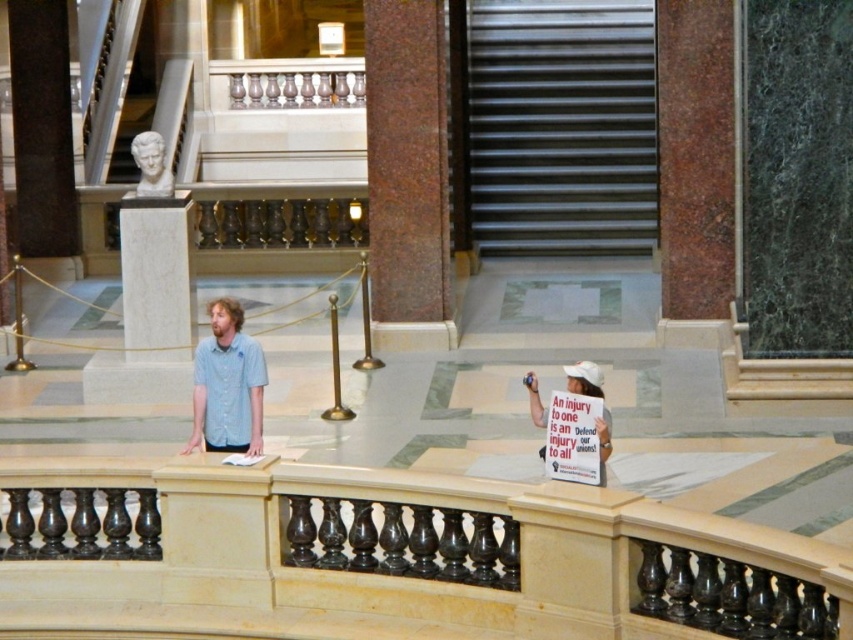
Between polished stone balustrade at center and metallic gray stairs at center, which one has more height?

polished stone balustrade at center

The width and height of the screenshot is (853, 640). Describe the element at coordinates (416, 552) in the screenshot. I see `polished stone balustrade at center` at that location.

Locate an element on the screen. The image size is (853, 640). polished stone balustrade at center is located at coordinates (416, 552).

At what (x,y) coordinates should I click in order to perform the action: click on metallic gray stairs at center. Please return your answer as a coordinate pair (x, y). Image resolution: width=853 pixels, height=640 pixels. Looking at the image, I should click on point(561,125).

Locate an element on the screen. The height and width of the screenshot is (640, 853). metallic gray stairs at center is located at coordinates (561, 125).

Is metallic gray stairs at center taller than white paper sign at center?

No.

Can you confirm if metallic gray stairs at center is thinner than white paper sign at center?

No.

Which is behind, point (509, 205) or point (537, 404)?

Point (509, 205)

Identify the location of metallic gray stairs at center. This screenshot has height=640, width=853. (561, 125).